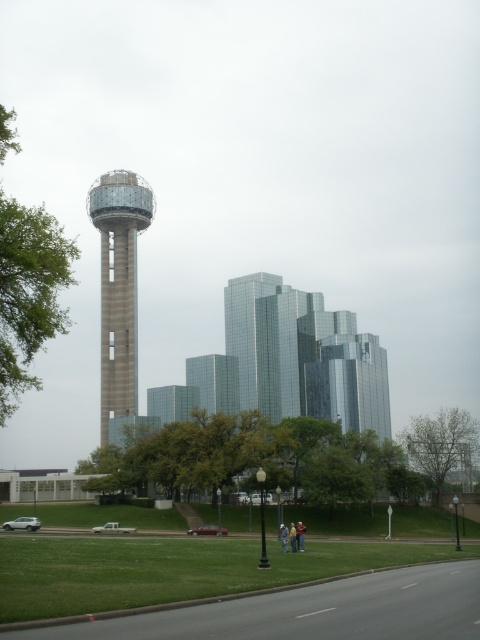
Question: Can you confirm if green grass at lower center is positioned to the right of green leafy tree at lower right?

Choices:
 (A) no
 (B) yes

Answer: (A)

Question: Which point is closer to the camera?

Choices:
 (A) green leafy tree at left
 (B) green leafy tree at lower right
 (C) concrete tower at center
 (D) green grass at lower center

Answer: (D)

Question: Where is concrete tower at center located in relation to green leafy tree at lower right in the image?

Choices:
 (A) right
 (B) left

Answer: (B)

Question: Does green leafy tree at left appear under green leafy tree at lower right?

Choices:
 (A) yes
 (B) no

Answer: (B)

Question: Which is farther from the green grass at lower center?

Choices:
 (A) green leafy tree at left
 (B) concrete tower at center

Answer: (B)

Question: Which of the following is the farthest from the observer?

Choices:
 (A) green leafy tree at lower right
 (B) green grass at lower center

Answer: (A)